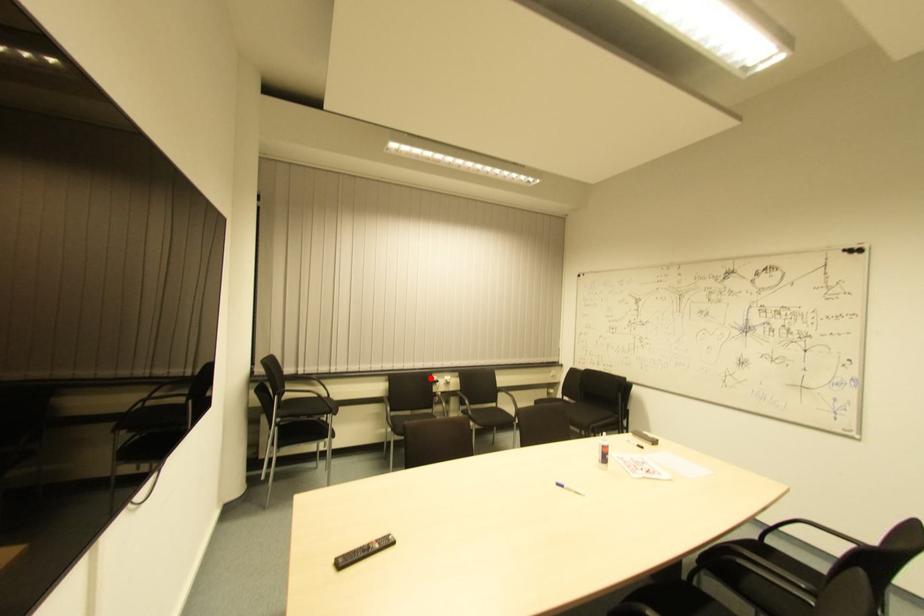
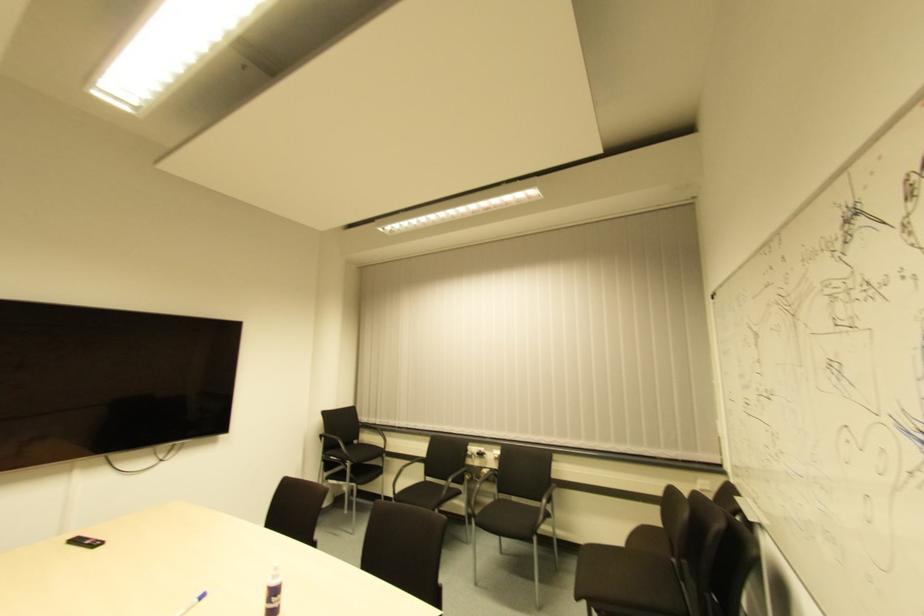
Question: A red point is marked in image1. In image2, is the corresponding 3D point closer to the camera or farther? Reply with the corresponding letter.

Choices:
 (A) The corresponding 3D point is closer.
 (B) The corresponding 3D point is farther.

Answer: (A)